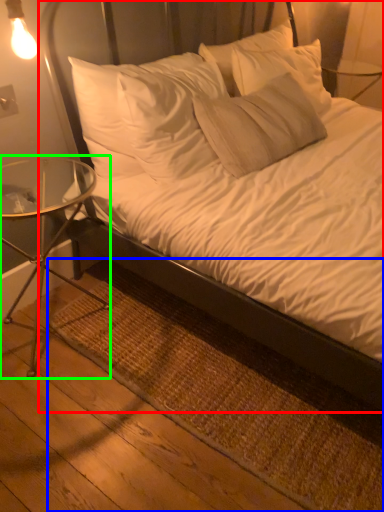
Question: Which object is positioned closest to bed (highlighted by a red box)? Select from mat (highlighted by a blue box) and table (highlighted by a green box).

Choices:
 (A) mat
 (B) table

Answer: (A)